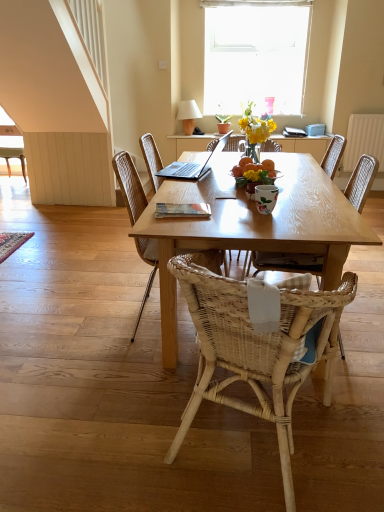
Where is `empty space that is in between white glossy coffee cup at center and wooden book at center`? The image size is (384, 512). empty space that is in between white glossy coffee cup at center and wooden book at center is located at coordinates (239, 209).